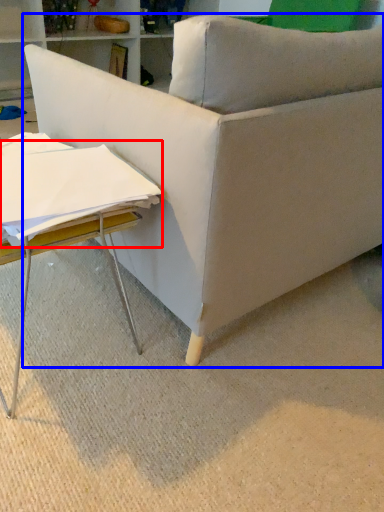
Question: Which object appears farthest to the camera in this image, sheet (highlighted by a red box) or studio couch (highlighted by a blue box)?

Choices:
 (A) sheet
 (B) studio couch

Answer: (A)